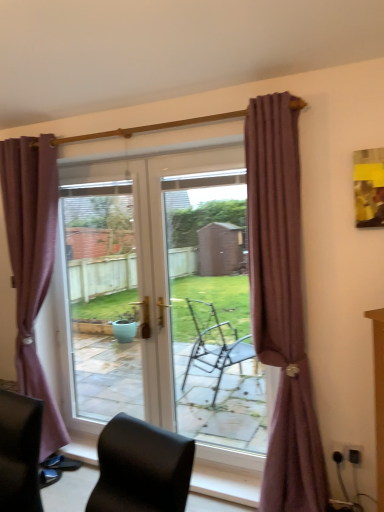
The width and height of the screenshot is (384, 512). What are the coordinates of `free space above transparent glass door at center (from a real-world perspective)` in the screenshot? It's located at (203, 176).